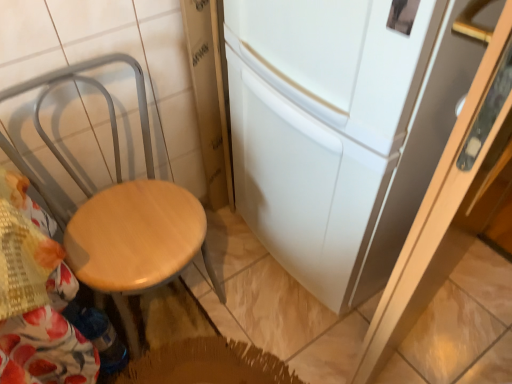
Identify the location of spots to the right of wooden seat at left. The height and width of the screenshot is (384, 512). (251, 313).